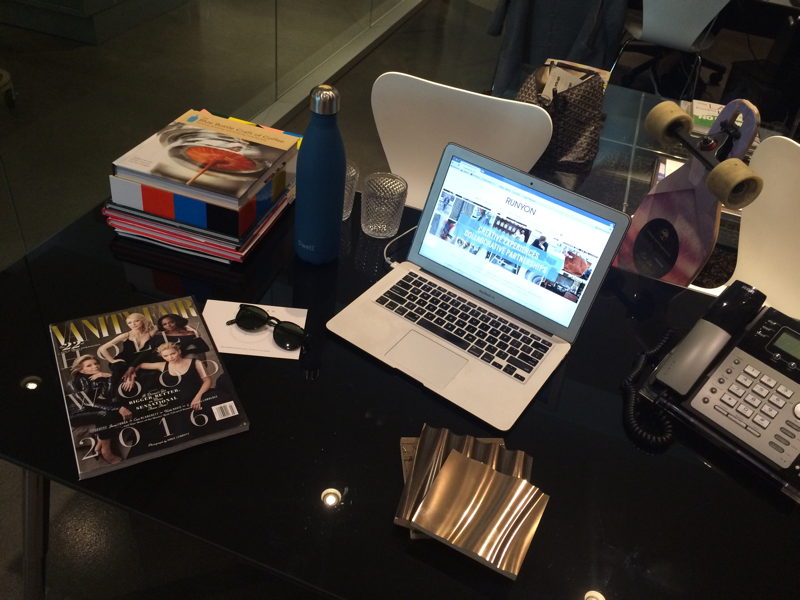
I want to click on chair, so click(x=480, y=139), click(x=630, y=500).